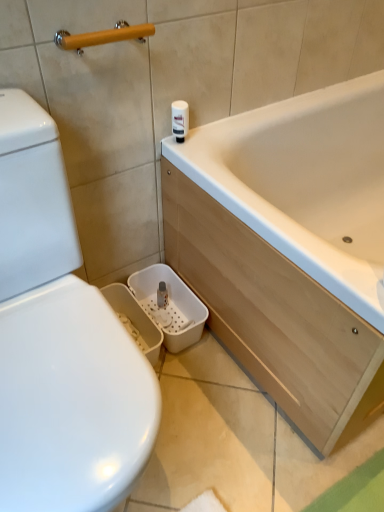
This screenshot has width=384, height=512. What do you see at coordinates (180, 119) in the screenshot?
I see `white glossy toilet paper at upper center` at bounding box center [180, 119].

Find the location of `white glossy toilet paper at upper center`. white glossy toilet paper at upper center is located at coordinates (180, 119).

At what (x,y) coordinates should I click in order to perform the action: click on wooden handle at upper left. Please return your answer as a coordinate pair (x, y). This screenshot has width=384, height=512. Looking at the image, I should click on (103, 36).

This screenshot has width=384, height=512. What do you see at coordinates (103, 36) in the screenshot? I see `wooden handle at upper left` at bounding box center [103, 36].

Measure the distance between point (139, 39) and camera.

The distance of point (139, 39) from camera is 90.10 centimeters.

Where is `white glossy toilet paper at upper center`? This screenshot has width=384, height=512. white glossy toilet paper at upper center is located at coordinates (180, 119).

Is wooden handle at upper left to the right of white glossy toilet paper at upper center from the viewer's perspective?

No, wooden handle at upper left is not to the right of white glossy toilet paper at upper center.

Is wooden handle at upper left further to camera compared to white glossy toilet paper at upper center?

No, it is in front of white glossy toilet paper at upper center.

Is point (67, 35) closer or farther from the camera than point (175, 127)?

Point (67, 35).

From the image's perspective, is wooden handle at upper left located above or below white glossy toilet paper at upper center?

wooden handle at upper left is above white glossy toilet paper at upper center.

From a real-world perspective, is wooden handle at upper left beneath white glossy toilet paper at upper center?

No, from a real-world perspective, wooden handle at upper left is not beneath white glossy toilet paper at upper center.

Which of these two, wooden handle at upper left or white glossy toilet paper at upper center, is wider?

With larger width is wooden handle at upper left.

In the scene shown: Can you confirm if wooden handle at upper left is shorter than white glossy toilet paper at upper center?

Indeed, wooden handle at upper left has a lesser height compared to white glossy toilet paper at upper center.

Who is smaller, wooden handle at upper left or white glossy toilet paper at upper center?

Smaller between the two is white glossy toilet paper at upper center.

Would you say white glossy toilet paper at upper center is part of wooden handle at upper left's contents?

No, white glossy toilet paper at upper center is located outside of wooden handle at upper left.

Consider the image. Is there a large distance between wooden handle at upper left and white glossy toilet paper at upper center?

No, wooden handle at upper left is not far away from white glossy toilet paper at upper center.

Is wooden handle at upper left oriented away from white glossy toilet paper at upper center?

That's not correct — wooden handle at upper left is not looking away from white glossy toilet paper at upper center.

How many degrees apart are the facing directions of wooden handle at upper left and white glossy toilet paper at upper center?

3.06 degrees separate the facing orientations of wooden handle at upper left and white glossy toilet paper at upper center.

This screenshot has width=384, height=512. I want to click on toilet paper on the right of wooden handle at upper left, so click(x=180, y=119).

Would you say white glossy toilet paper at upper center is to the left or to the right of wooden handle at upper left in the picture?

From the image, it's evident that white glossy toilet paper at upper center is to the right of wooden handle at upper left.

Considering their positions, is white glossy toilet paper at upper center located in front of or behind wooden handle at upper left?

Clearly, white glossy toilet paper at upper center is behind wooden handle at upper left.

Does point (183, 134) come closer to viewer compared to point (145, 41)?

No, (183, 134) is behind (145, 41).

From the image's perspective, is white glossy toilet paper at upper center located beneath wooden handle at upper left?

Yes, from the image's perspective, white glossy toilet paper at upper center is beneath wooden handle at upper left.

From a real-world perspective, is white glossy toilet paper at upper center physically below wooden handle at upper left?

Correct, in the physical world, white glossy toilet paper at upper center is lower than wooden handle at upper left.

Looking at their sizes, would you say white glossy toilet paper at upper center is wider or thinner than wooden handle at upper left?

white glossy toilet paper at upper center is thinner than wooden handle at upper left.

Who is shorter, white glossy toilet paper at upper center or wooden handle at upper left?

wooden handle at upper left.

Who is smaller, white glossy toilet paper at upper center or wooden handle at upper left?

white glossy toilet paper at upper center.

Would you say wooden handle at upper left is part of white glossy toilet paper at upper center's contents?

No, wooden handle at upper left is not inside white glossy toilet paper at upper center.

Is white glossy toilet paper at upper center next to wooden handle at upper left?

There is a gap between white glossy toilet paper at upper center and wooden handle at upper left.

Is white glossy toilet paper at upper center oriented away from wooden handle at upper left?

No, white glossy toilet paper at upper center's orientation is not away from wooden handle at upper left.

What's the angular difference between white glossy toilet paper at upper center and wooden handle at upper left's facing directions?

They differ by 3.06 degrees in their facing directions.

Measure the distance between white glossy toilet paper at upper center and wooden handle at upper left.

9.97 inches.

In order to click on towel bar that is above the white glossy toilet paper at upper center (from a real-world perspective) in this screenshot , I will do `click(103, 36)`.

At what (x,y) coordinates should I click in order to perform the action: click on toilet paper behind the wooden handle at upper left. Please return your answer as a coordinate pair (x, y). The image size is (384, 512). Looking at the image, I should click on (180, 119).

Where is `towel bar above the white glossy toilet paper at upper center (from a real-world perspective)`? This screenshot has height=512, width=384. towel bar above the white glossy toilet paper at upper center (from a real-world perspective) is located at coordinates (103, 36).